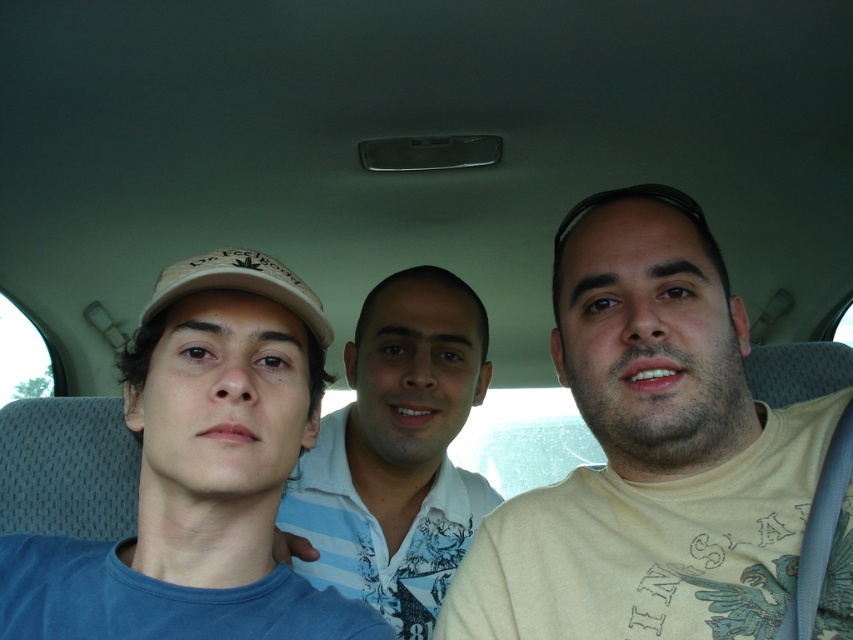
You are a photographer trying to capture a clear shot of the beige cotton shirt at center and the white matte baseball cap at center inside the car. Since the camera has a limited depth of field, you need to focus on the closer object. Which object should you focus on to ensure it is in focus?

The beige cotton shirt at center has a greater height compared to the white matte baseball cap at center, so focusing on the closer object would require determining which is nearer. However, the description only provides information about their heights, not their distances. Without knowing which is closer, it is impossible to determine the correct focus point based on the given details.

You are a photographer taking a picture of the blue cotton shirt at left and the white striped shirt at center inside a car. Based on their positions, which shirt would appear closer to the camera?

The blue cotton shirt at left is shorter than the white striped shirt at center, so it would appear closer to the camera.

You are a photographer inside a car and want to take a photo of the beige cotton shirt at center and the white striped shirt at center. Which shirt should you move to your left to frame them properly?

The beige cotton shirt at center is to the right of the white striped shirt at center, so you should move the beige cotton shirt at center to the left to align them properly.